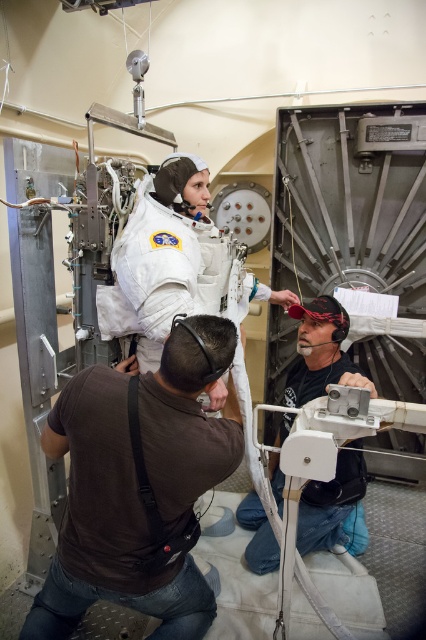
Based on the photo, which of these two, brown fabric shirt at lower left or matte black helmet at lower right, stands shorter?

With less height is brown fabric shirt at lower left.

Does brown fabric shirt at lower left appear on the left side of matte black helmet at lower right?

Indeed, brown fabric shirt at lower left is positioned on the left side of matte black helmet at lower right.

Where is `brown fabric shirt at lower left`? Image resolution: width=426 pixels, height=640 pixels. brown fabric shirt at lower left is located at coordinates (108, 522).